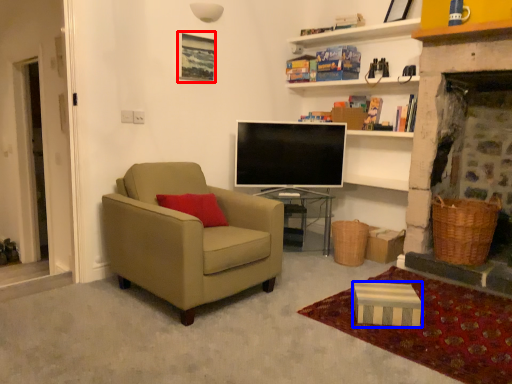
Question: Among these objects, which one is nearest to the camera, picture frame (highlighted by a red box) or box (highlighted by a blue box)?

Choices:
 (A) picture frame
 (B) box

Answer: (B)